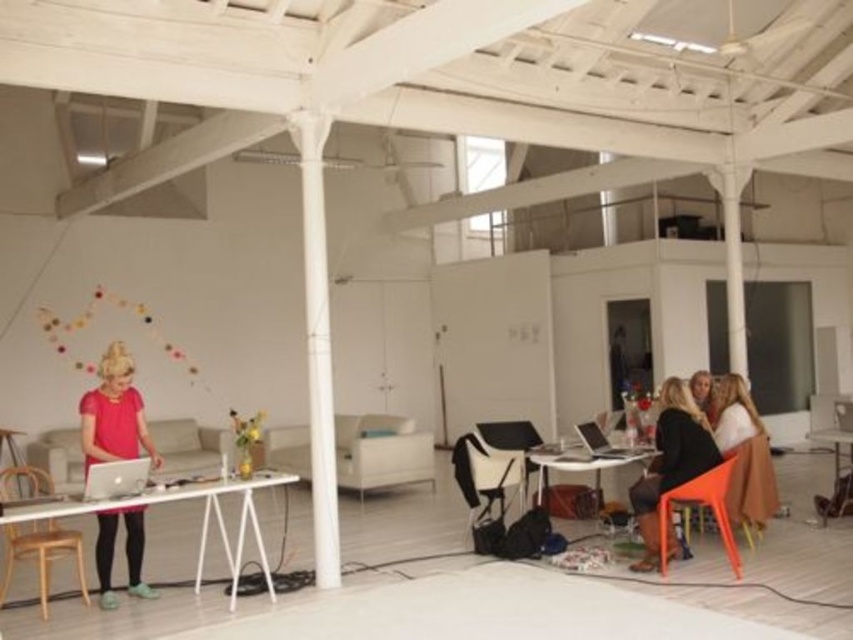
Is matte white table at lower right thinner than silver metallic laptop at left?

Incorrect, matte white table at lower right's width is not less than silver metallic laptop at left's.

Which is in front, point (549, 445) or point (134, 461)?

Point (134, 461)

Between point (637, 461) and point (113, 474), which one is positioned behind?

Positioned behind is point (637, 461).

Find the location of `matte white table at lower right`. matte white table at lower right is located at coordinates (581, 465).

Which of these two, smooth beige sweater at right or silver metallic laptop at lower right, stands shorter?

With less height is silver metallic laptop at lower right.

Identify the location of smooth beige sweater at right. (733, 412).

Identify the location of smooth beige sweater at right. (733, 412).

This screenshot has width=853, height=640. I want to click on smooth beige sweater at right, so [x=733, y=412].

Between white fabric couch at center and white plastic table at lower right, which one is positioned higher?

white plastic table at lower right is higher up.

What do you see at coordinates (381, 451) in the screenshot? The width and height of the screenshot is (853, 640). I see `white fabric couch at center` at bounding box center [381, 451].

The image size is (853, 640). In order to click on white fabric couch at center in this screenshot , I will do `click(381, 451)`.